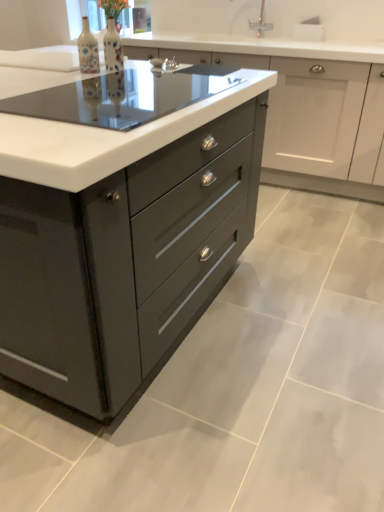
Locate an element on the screen. free space in front of matte ceramic bottle at upper left, the first bottle viewed from the left is located at coordinates (75, 74).